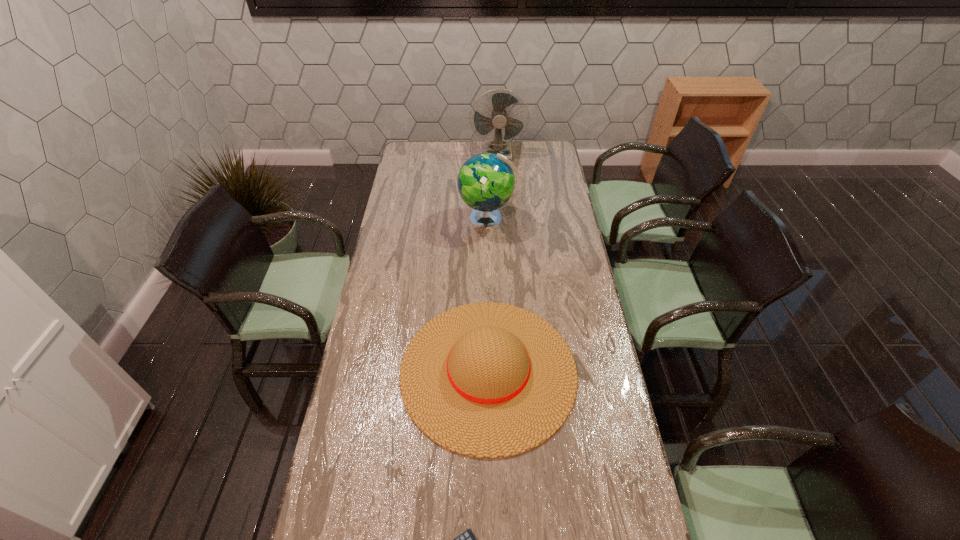
You are a GUI agent. You are given a task and a screenshot of the screen. Output one action in this format:
    pyautogui.click(x=<x>, y=<y>)
    Task: Click on the vacant region that satisfies the following two spatial constraints: 1. on the front-facing side of the farthest object; 2. on the front surface of the third nearest object
    Image resolution: width=960 pixels, height=540 pixels.
    Given the screenshot: What is the action you would take?
    pyautogui.click(x=502, y=220)

This screenshot has height=540, width=960. In order to click on free point that satisfies the following two spatial constraints: 1. on the front surface of the second farthest object; 2. on the front side of the second nearest object in this screenshot , I will do `click(492, 370)`.

The height and width of the screenshot is (540, 960). In order to click on free space in the image that satisfies the following two spatial constraints: 1. on the front-facing side of the farthest object; 2. on the front surface of the globe in this screenshot , I will do `click(502, 220)`.